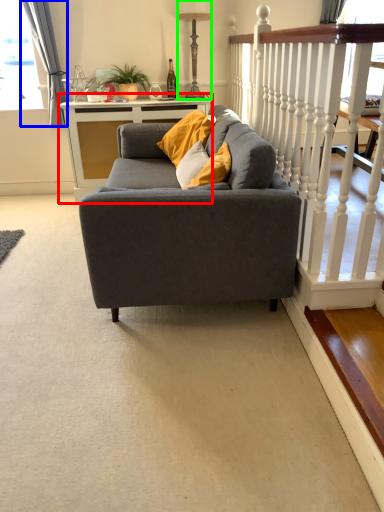
Question: Which object is the farthest from table (highlighted by a red box)? Choose among these: curtain (highlighted by a blue box) or lamp (highlighted by a green box).

Choices:
 (A) curtain
 (B) lamp

Answer: (B)